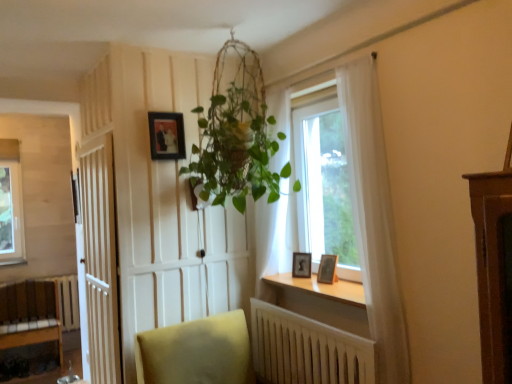
Question: From a real-world perspective, is white wooden door at left beneath matte black frame at upper center, arranged as the first picture frame when viewed from the left?

Choices:
 (A) no
 (B) yes

Answer: (B)

Question: From the image's perspective, would you say white wooden door at left is positioned over matte black frame at upper center, acting as the 3th picture frame starting from the right?

Choices:
 (A) no
 (B) yes

Answer: (A)

Question: Is white wooden door at left aimed at matte black frame at upper center, the third picture frame in the bottom-to-top sequence?

Choices:
 (A) yes
 (B) no

Answer: (B)

Question: Can matte black frame at upper center, the third picture frame in the bottom-to-top sequence, be found inside white wooden door at left?

Choices:
 (A) yes
 (B) no

Answer: (B)

Question: Does white wooden door at left have a greater height compared to matte black frame at upper center, arranged as the first picture frame when viewed from the left?

Choices:
 (A) yes
 (B) no

Answer: (A)

Question: Is wooden at lower center taller or shorter than matte black frame at upper center, acting as the 3th picture frame starting from the right?

Choices:
 (A) tall
 (B) short

Answer: (B)

Question: Considering their positions, is wooden at lower center located in front of or behind matte black frame at upper center, acting as the 3th picture frame starting from the right?

Choices:
 (A) front
 (B) behind

Answer: (A)

Question: Looking at the image, does wooden at lower center seem bigger or smaller compared to matte black frame at upper center, acting as the 3th picture frame starting from the right?

Choices:
 (A) big
 (B) small

Answer: (A)

Question: In terms of width, does wooden at lower center look wider or thinner when compared to matte black frame at upper center, the third picture frame in the bottom-to-top sequence?

Choices:
 (A) wide
 (B) thin

Answer: (A)

Question: Is wooden radiator at lower center taller or shorter than wooden bench at lower left?

Choices:
 (A) short
 (B) tall

Answer: (A)

Question: Is wooden radiator at lower center in front of or behind wooden bench at lower left in the image?

Choices:
 (A) behind
 (B) front

Answer: (B)

Question: From the image's perspective, relative to wooden bench at lower left, is wooden radiator at lower center above or below?

Choices:
 (A) below
 (B) above

Answer: (B)

Question: Is wooden radiator at lower center wider or thinner than wooden bench at lower left?

Choices:
 (A) thin
 (B) wide

Answer: (A)

Question: From a real-world perspective, is matte black frame at upper center, acting as the 3th picture frame starting from the right, physically located above or below wooden radiator at lower center?

Choices:
 (A) above
 (B) below

Answer: (A)

Question: In the image, is matte black frame at upper center, the first picture frame viewed from the top, on the left side or the right side of wooden radiator at lower center?

Choices:
 (A) right
 (B) left

Answer: (B)